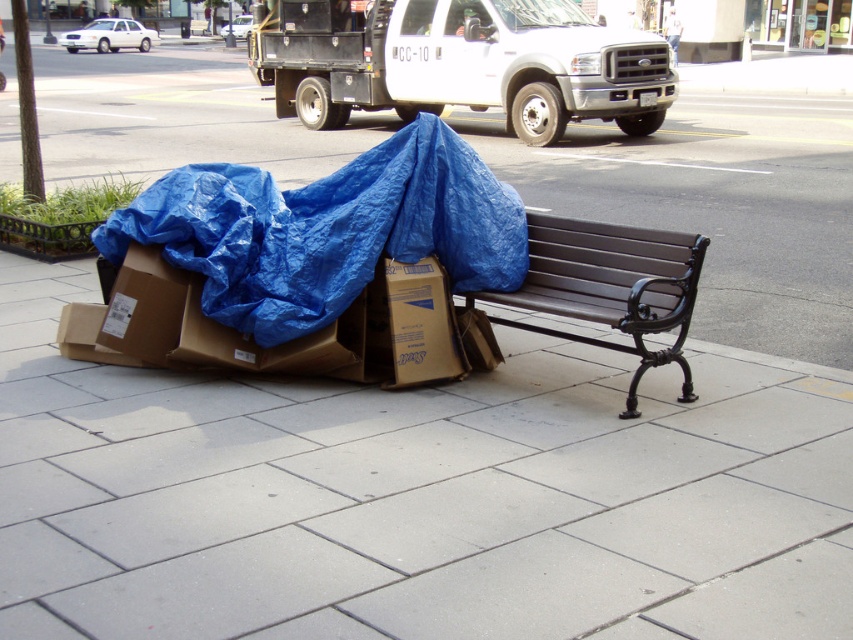
You are standing at the center of the sidewalk and want to place a small potted plant between the blue tarp at lower left and the public bench. Based on their positions, can you determine if there is enough space to place the plant without it being too close to either object?

The blue tarp at lower left is located at point (328,228), so there is sufficient space between the blue tarp at lower left and the public bench to place the small potted plant without it being too close to either object.

You are standing at the center of the sidewalk and want to place a small potted plant exactly at the point marked by coordinates point (328, 228). However, you notice an object at that location. What is the object blocking the placement of the potted plant?

The blue tarp at lower left is located at point (328, 228), so it is blocking the placement of the potted plant there.

You are a delivery person who needs to place a new package on the sidewalk. The package is the size of the brown cardboard box at lower center. Is there enough space between the brown wooden bench at center and the edge of the sidewalk to place the package?

The brown wooden bench at center is wider than the brown cardboard box at lower center. Since the bench is wider, there should be sufficient space between the bench and the edge of the sidewalk to place the package.